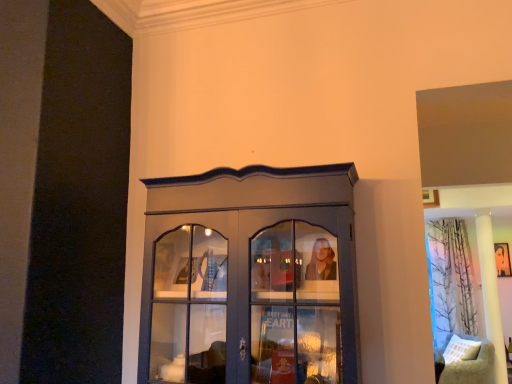
Question: Visually, is smooth black portrait at upper right positioned to the left or to the right of beige fabric cushion at lower right?

Choices:
 (A) left
 (B) right

Answer: (B)

Question: Looking at their shapes, would you say smooth black portrait at upper right is wider or thinner than beige fabric cushion at lower right?

Choices:
 (A) thin
 (B) wide

Answer: (A)

Question: Based on their relative distances, which object is farther from the smooth black portrait at upper right?

Choices:
 (A) beige fabric cushion at lower right
 (B) printed fabric curtain at right
 (C) matte gray cupboard at center

Answer: (C)

Question: Which object is positioned farthest from the printed fabric curtain at right?

Choices:
 (A) beige fabric cushion at lower right
 (B) smooth black portrait at upper right
 (C) matte gray cupboard at center

Answer: (C)